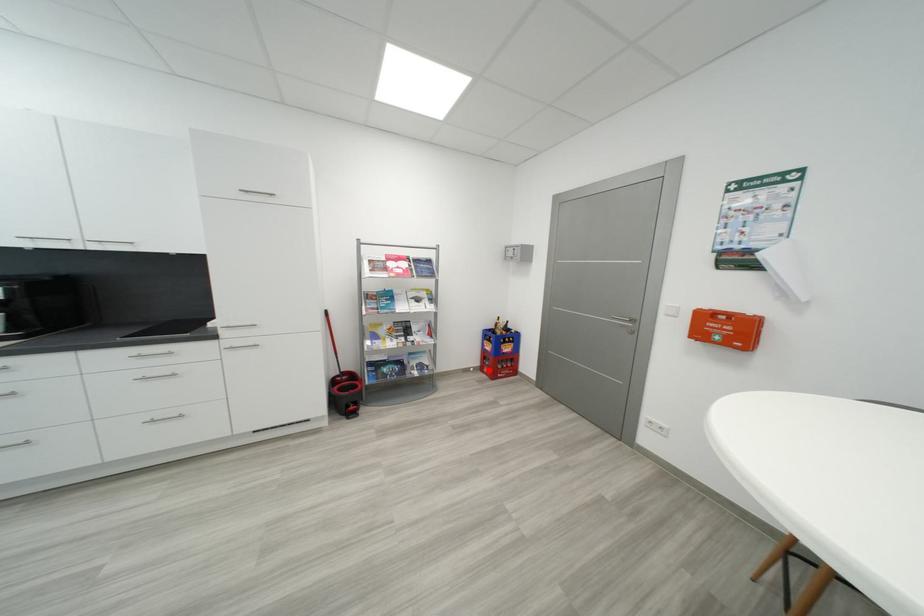
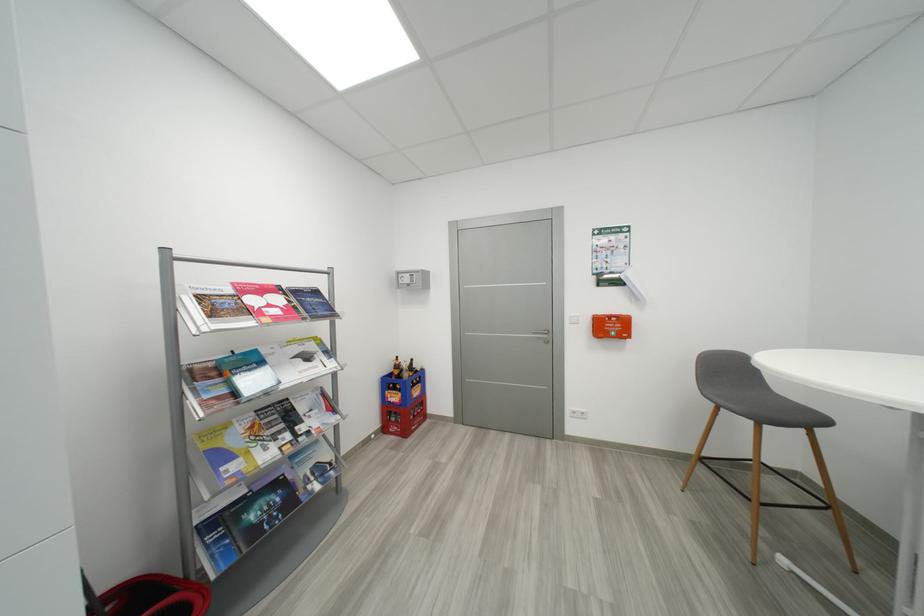
Question: I am providing you with two images of the same scene from different viewpoints. Given a red point in image1, look at the same physical point in image2. Is it:

Choices:
 (A) Closer to the viewpoint
 (B) Farther from the viewpoint

Answer: (B)